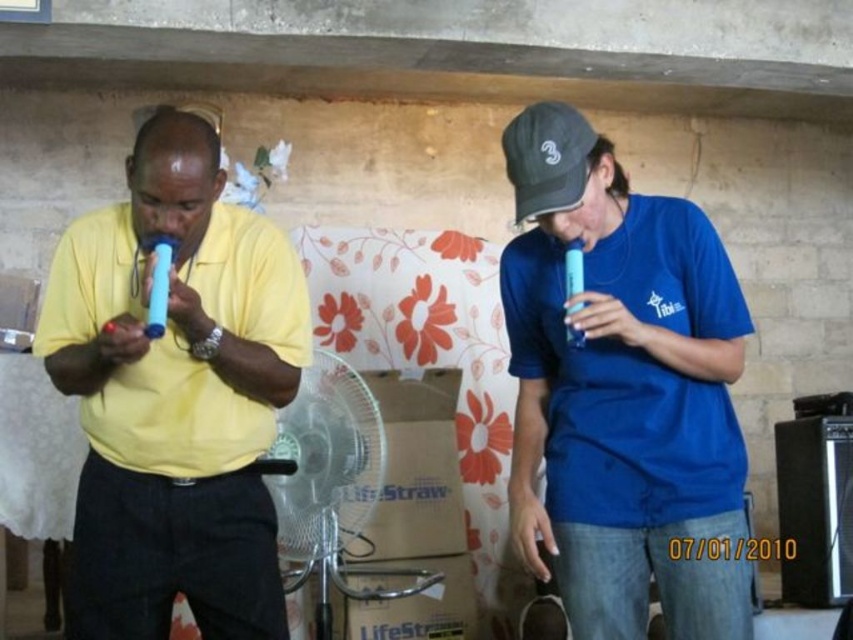
Between clear plastic fan at center and black fabric baseball cap at upper right, which one is positioned lower?

Positioned lower is clear plastic fan at center.

Between clear plastic fan at center and black fabric baseball cap at upper right, which one appears on the left side from the viewer's perspective?

From the viewer's perspective, clear plastic fan at center appears more on the left side.

This screenshot has width=853, height=640. I want to click on clear plastic fan at center, so click(329, 483).

Is point (157, 168) positioned behind point (553, 116)?

No.

Where is `matte yellow shirt at left`? matte yellow shirt at left is located at coordinates (175, 396).

Locate an element on the screen. matte yellow shirt at left is located at coordinates point(175,396).

Who is taller, matte yellow shirt at left or clear plastic fan at center?

Standing taller between the two is matte yellow shirt at left.

Describe the element at coordinates (175, 396) in the screenshot. I see `matte yellow shirt at left` at that location.

The height and width of the screenshot is (640, 853). I want to click on matte yellow shirt at left, so click(x=175, y=396).